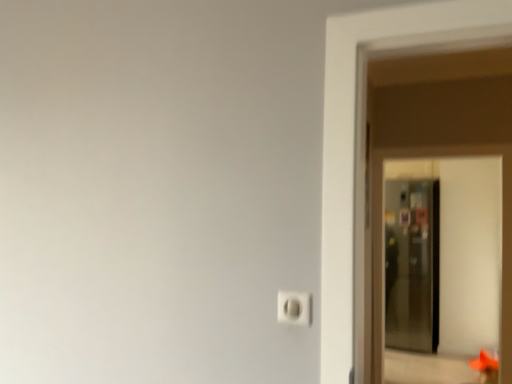
Question: Would you say transparent glass screen door at right is part of white plastic light switch at lower center's contents?

Choices:
 (A) no
 (B) yes

Answer: (A)

Question: Is white plastic light switch at lower center in front of transparent glass screen door at right?

Choices:
 (A) no
 (B) yes

Answer: (B)

Question: Is white plastic light switch at lower center to the left of transparent glass screen door at right from the viewer's perspective?

Choices:
 (A) yes
 (B) no

Answer: (A)

Question: Does white plastic light switch at lower center turn towards transparent glass screen door at right?

Choices:
 (A) no
 (B) yes

Answer: (A)

Question: Does white plastic light switch at lower center have a lesser width compared to transparent glass screen door at right?

Choices:
 (A) no
 (B) yes

Answer: (B)

Question: Would you consider white plastic light switch at lower center to be distant from transparent glass screen door at right?

Choices:
 (A) yes
 (B) no

Answer: (A)

Question: Considering the relative sizes of transparent glass screen door at right and white plastic light switch at lower center in the image provided, is transparent glass screen door at right shorter than white plastic light switch at lower center?

Choices:
 (A) no
 (B) yes

Answer: (A)

Question: Does transparent glass screen door at right appear on the right side of white plastic light switch at lower center?

Choices:
 (A) no
 (B) yes

Answer: (B)

Question: Can you confirm if transparent glass screen door at right is wider than white plastic light switch at lower center?

Choices:
 (A) yes
 (B) no

Answer: (A)

Question: From a real-world perspective, does transparent glass screen door at right stand above white plastic light switch at lower center?

Choices:
 (A) no
 (B) yes

Answer: (A)

Question: Could you tell me if transparent glass screen door at right is facing white plastic light switch at lower center?

Choices:
 (A) yes
 (B) no

Answer: (A)

Question: Considering the relative sizes of transparent glass screen door at right and white plastic light switch at lower center in the image provided, is transparent glass screen door at right smaller than white plastic light switch at lower center?

Choices:
 (A) yes
 (B) no

Answer: (B)

Question: Would you say white plastic light switch at lower center is inside or outside transparent glass screen door at right?

Choices:
 (A) inside
 (B) outside

Answer: (B)